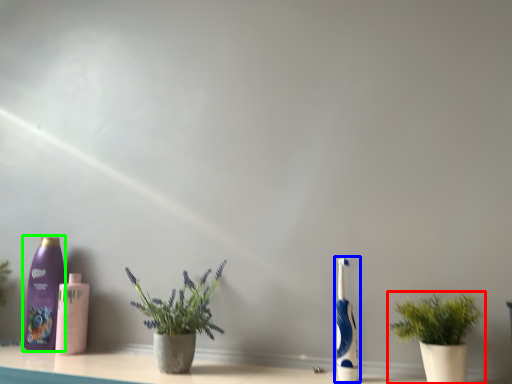
Question: Which is farther away from houseplant (highlighted by a red box)? toothbrush (highlighted by a blue box) or bottle (highlighted by a green box)?

Choices:
 (A) toothbrush
 (B) bottle

Answer: (B)